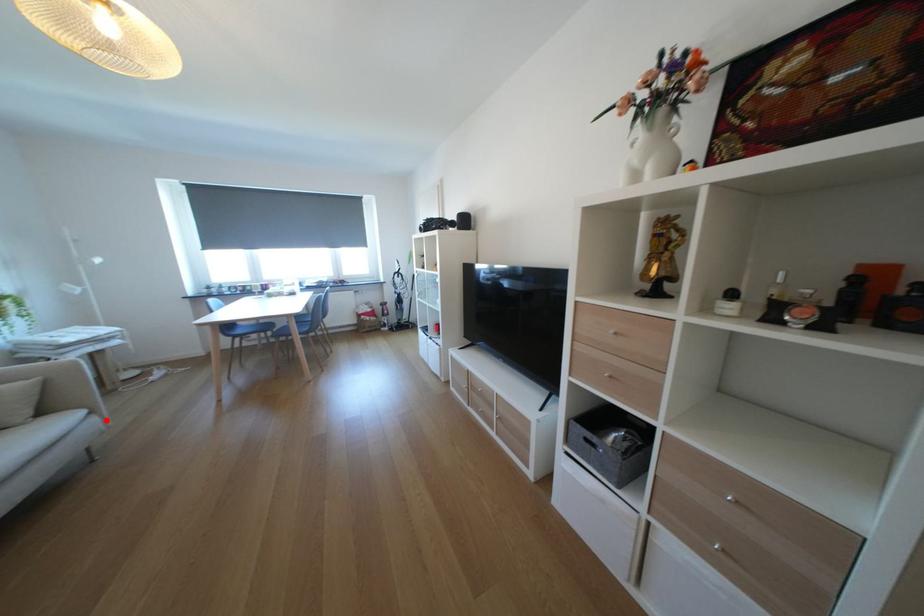
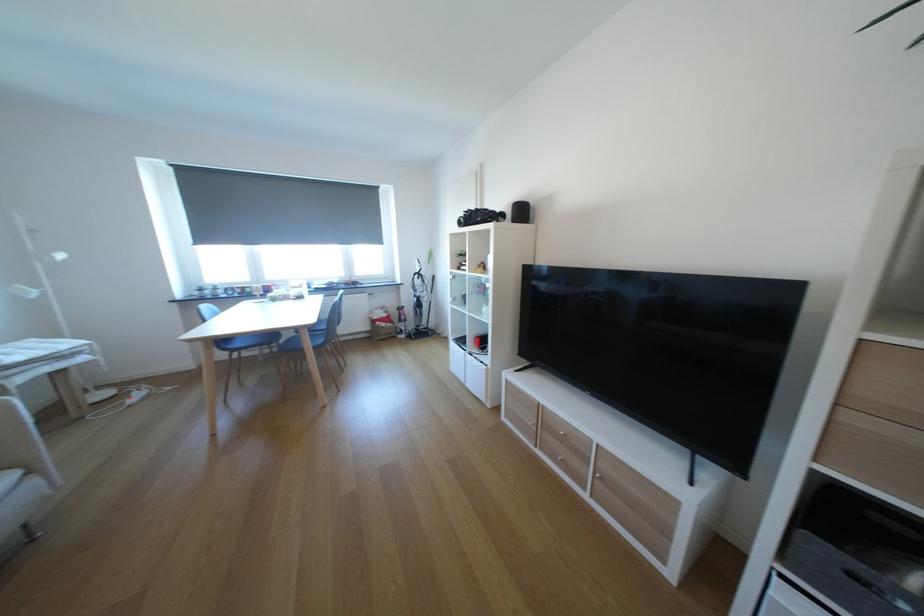
The point at the highlighted location is marked in the first image. Where is the corresponding point in the second image?

(45, 483)